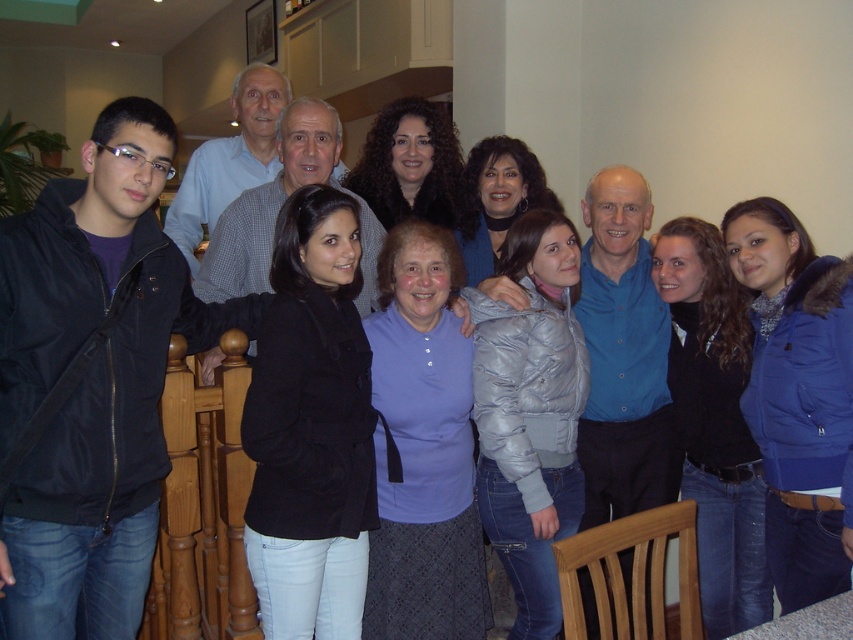
You are organizing a photo shoot and need to ensure that all clothing items in the image are visible. Given that the black matte jacket at center and the dark blue puffy jacket at center are both central to the composition, which jacket should you adjust to make more room for the other?

The black matte jacket at center occupies less space than the dark blue puffy jacket at center, so you should adjust the dark blue puffy jacket at center to make more room for the black matte jacket at center.

You are at a family gathering and want to borrow a jacket. You see the black matte jacket at center and the dark blue puffy jacket at center. Which one is located to the left?

The black matte jacket at center is to the left of the dark blue puffy jacket at center.